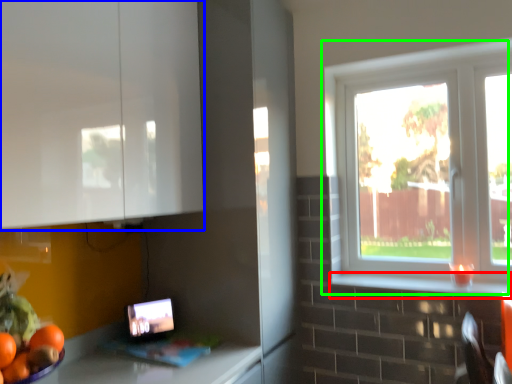
Question: Which is farther away from window sill (highlighted by a red box)? cabinetry (highlighted by a blue box) or window (highlighted by a green box)?

Choices:
 (A) cabinetry
 (B) window

Answer: (A)